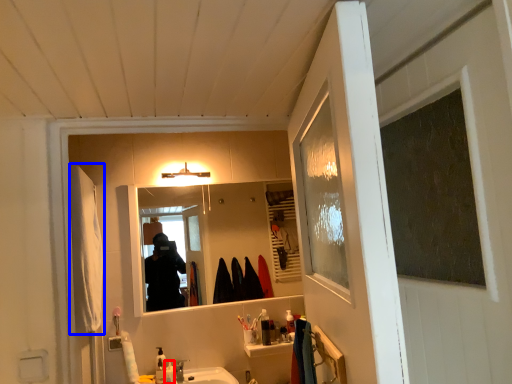
Question: Which point is further to the camera, toiletry (highlighted by a red box) or robe (highlighted by a blue box)?

Choices:
 (A) toiletry
 (B) robe

Answer: (A)